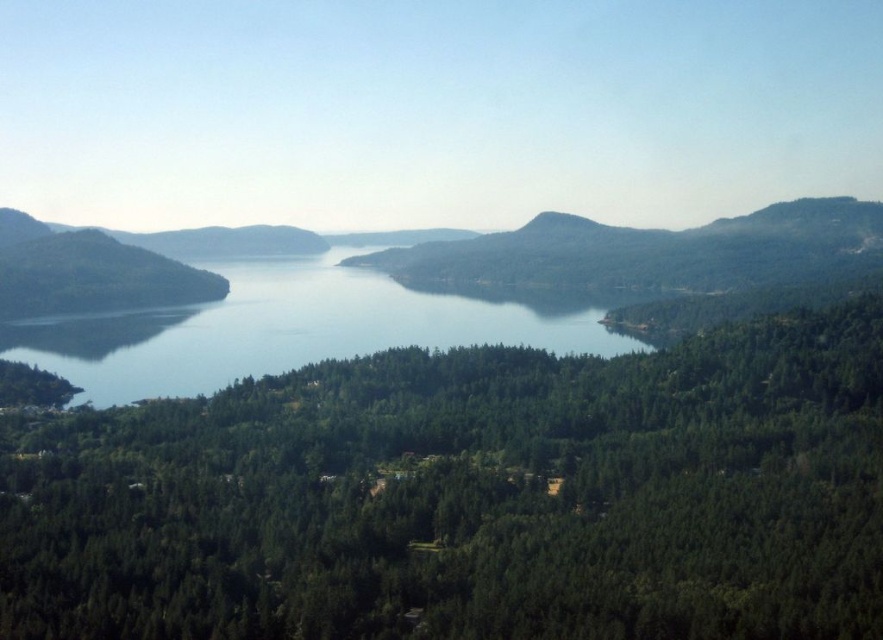
You are standing on the shore of the lake and want to take a photo that includes both the green matte forest at center and the clear blue water at center. Based on their positions, which object should you place on the left side of your photo frame to ensure both are visible?

The clear blue water at center should be placed on the left side of your photo frame because the green matte forest at center is positioned on the right side of it.

You are standing in the serene landscape and want to place a small flag at both point (688,384) and point (127,396). Which point will have the flag closer to your current position?

Point (688,384) is closer to the camera than point (127,396), so the flag at point (688,384) will be closer to your current position.